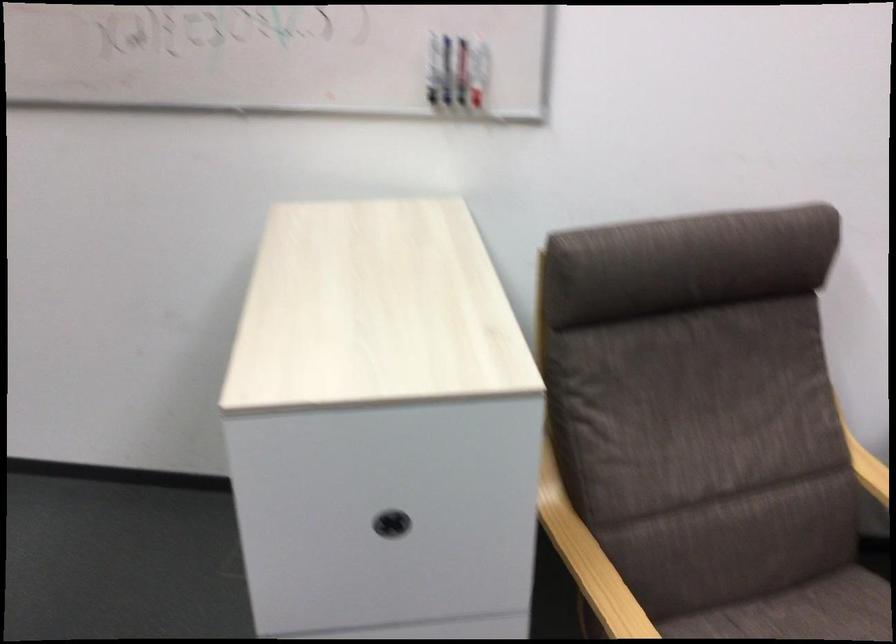
What do you see at coordinates (800, 612) in the screenshot? The width and height of the screenshot is (896, 644). I see `a chair sitting surface` at bounding box center [800, 612].